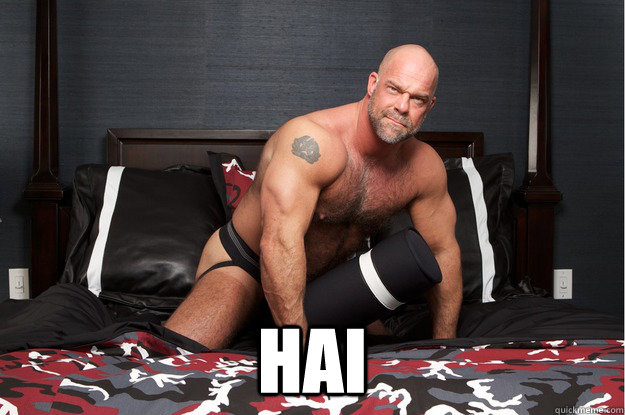
This screenshot has width=625, height=415. What are the coordinates of `white panel` in the screenshot? It's located at (569, 284), (16, 291).